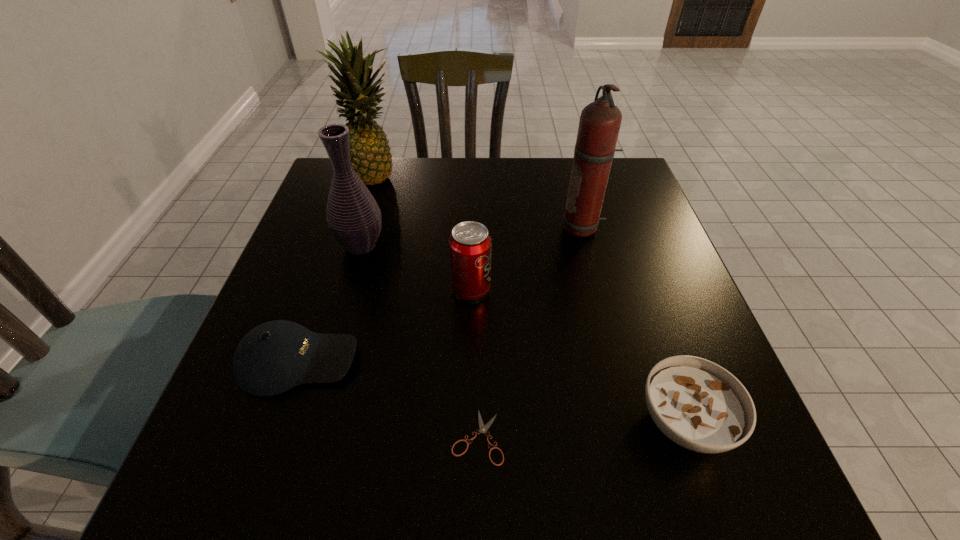
This screenshot has height=540, width=960. Identify the location of the second closest object to the shortest object. (699, 405).

Select which object appears as the fourth closest to the baseball cap. Please provide its 2D coordinates. Your answer should be formatted as a tuple, i.e. [(x, y)], where the tuple contains the x and y coordinates of a point satisfying the conditions above.

[(371, 159)]

Where is `vacant space that satisfies the following two spatial constraints: 1. on the front-facing side of the baseball cap; 2. on the right side of the shortest object`? The height and width of the screenshot is (540, 960). vacant space that satisfies the following two spatial constraints: 1. on the front-facing side of the baseball cap; 2. on the right side of the shortest object is located at coordinates (272, 437).

Identify the location of vacant area that satisfies the following two spatial constraints: 1. on the side of the soup bowl with the label and nozzle; 2. on the left side of the fire extinguisher. (634, 421).

Where is `free region that satisfies the following two spatial constraints: 1. on the front-facing side of the soup bowl; 2. on the left side of the baseball cap`? This screenshot has height=540, width=960. free region that satisfies the following two spatial constraints: 1. on the front-facing side of the soup bowl; 2. on the left side of the baseball cap is located at coordinates (277, 421).